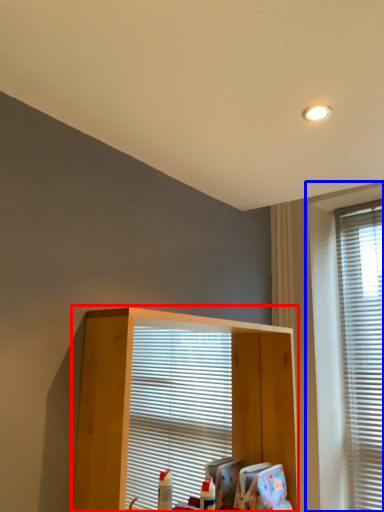
Question: Which object is further to the camera taking this photo, shelf (highlighted by a red box) or window (highlighted by a blue box)?

Choices:
 (A) shelf
 (B) window

Answer: (B)